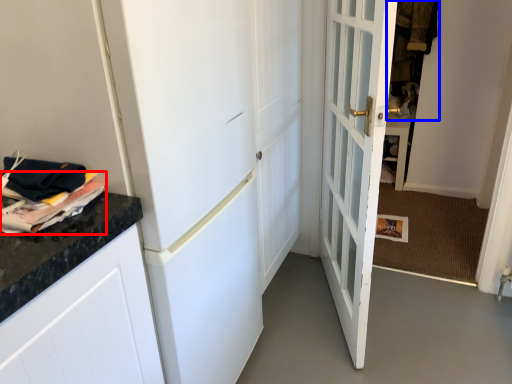
Question: Among these objects, which one is nearest to the camera, magazine (highlighted by a red box) or laundry (highlighted by a blue box)?

Choices:
 (A) magazine
 (B) laundry

Answer: (A)